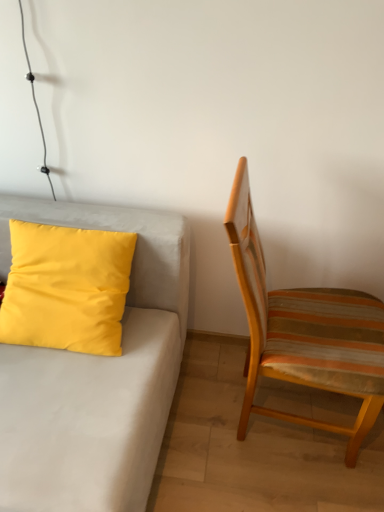
Question: Considering the relative positions of matte yellow pillow at upper left and yellow matte pillow at left in the image provided, is matte yellow pillow at upper left to the left or to the right of yellow matte pillow at left?

Choices:
 (A) left
 (B) right

Answer: (A)

Question: Is point (137, 247) closer or farther from the camera than point (54, 241)?

Choices:
 (A) farther
 (B) closer

Answer: (A)

Question: Estimate the real-world distances between objects in this image. Which object is farther from the matte yellow pillow at upper left?

Choices:
 (A) striped fabric chair at right
 (B) yellow matte pillow at left

Answer: (A)

Question: Which object is positioned closest to the yellow matte pillow at left?

Choices:
 (A) matte yellow pillow at upper left
 (B) striped fabric chair at right

Answer: (A)